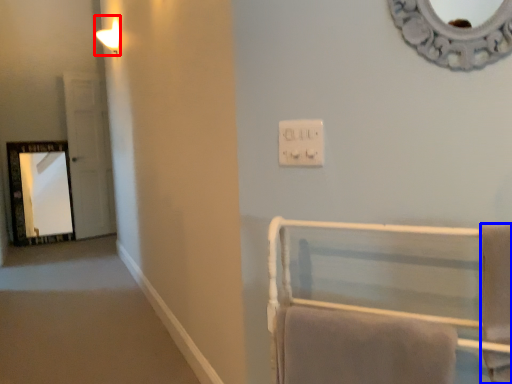
Question: Which point is further to the camera, light fixture (highlighted by a red box) or bath towel (highlighted by a blue box)?

Choices:
 (A) light fixture
 (B) bath towel

Answer: (A)